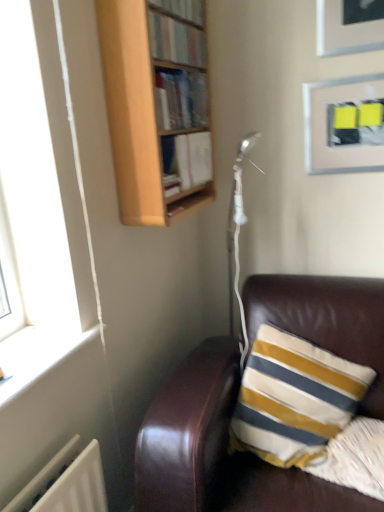
Question: From a real-world perspective, is wooden bookshelf at upper center, which appears as the 2th book when viewed from the top, located higher than metallic silver picture frame at upper right?

Choices:
 (A) no
 (B) yes

Answer: (B)

Question: Is wooden bookshelf at upper center, which appears as the 2th book when viewed from the top, to the right of metallic silver picture frame at upper right from the viewer's perspective?

Choices:
 (A) no
 (B) yes

Answer: (A)

Question: Is the position of wooden bookshelf at upper center, the second book ordered from the bottom, less distant than that of metallic silver picture frame at upper right?

Choices:
 (A) no
 (B) yes

Answer: (B)

Question: Can you confirm if wooden bookshelf at upper center, the second book ordered from the bottom, is thinner than metallic silver picture frame at upper right?

Choices:
 (A) yes
 (B) no

Answer: (B)

Question: Is wooden bookshelf at upper center, which appears as the 2th book when viewed from the top, oriented towards metallic silver picture frame at upper right?

Choices:
 (A) yes
 (B) no

Answer: (A)

Question: Is wooden bookshelf at upper center, which appears as the 2th book when viewed from the top, facing away from metallic silver picture frame at upper right?

Choices:
 (A) yes
 (B) no

Answer: (B)

Question: From the image's perspective, would you say hardcover book at upper center, the first book when ordered from bottom to top, is positioned over wooden bookcase at upper center?

Choices:
 (A) yes
 (B) no

Answer: (B)

Question: From the image's perspective, is hardcover book at upper center, the third book when ordered from top to bottom, below wooden bookcase at upper center?

Choices:
 (A) no
 (B) yes

Answer: (B)

Question: Can you confirm if hardcover book at upper center, the third book when ordered from top to bottom, is bigger than wooden bookcase at upper center?

Choices:
 (A) yes
 (B) no

Answer: (B)

Question: Is hardcover book at upper center, the first book when ordered from bottom to top, in front of wooden bookcase at upper center?

Choices:
 (A) yes
 (B) no

Answer: (B)

Question: Is hardcover book at upper center, the first book when ordered from bottom to top, not near wooden bookcase at upper center?

Choices:
 (A) no
 (B) yes

Answer: (A)

Question: Does hardcover book at upper center, the first book when ordered from bottom to top, appear on the right side of wooden bookcase at upper center?

Choices:
 (A) no
 (B) yes

Answer: (B)

Question: Considering the relative sizes of hardcover book at upper center, the first book when ordered from bottom to top, and striped fabric pillow at lower right in the image provided, is hardcover book at upper center, the first book when ordered from bottom to top, shorter than striped fabric pillow at lower right?

Choices:
 (A) yes
 (B) no

Answer: (A)